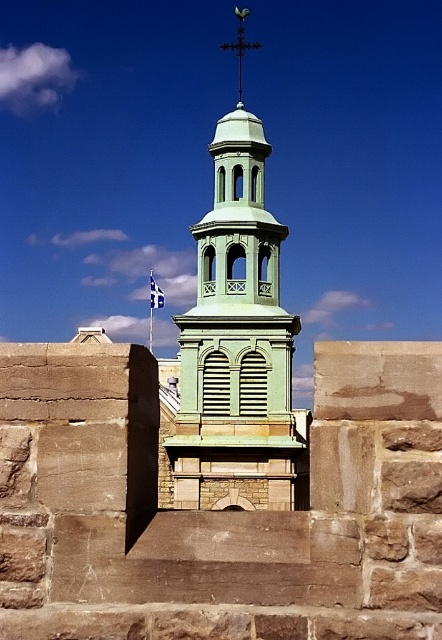
Between point (182, 339) and point (239, 42), which one is positioned behind?

Point (239, 42)

Is point (237, 180) farther from camera compared to point (244, 45)?

No, it is not.

Locate an element on the screen. green matte tower at center is located at coordinates (237, 340).